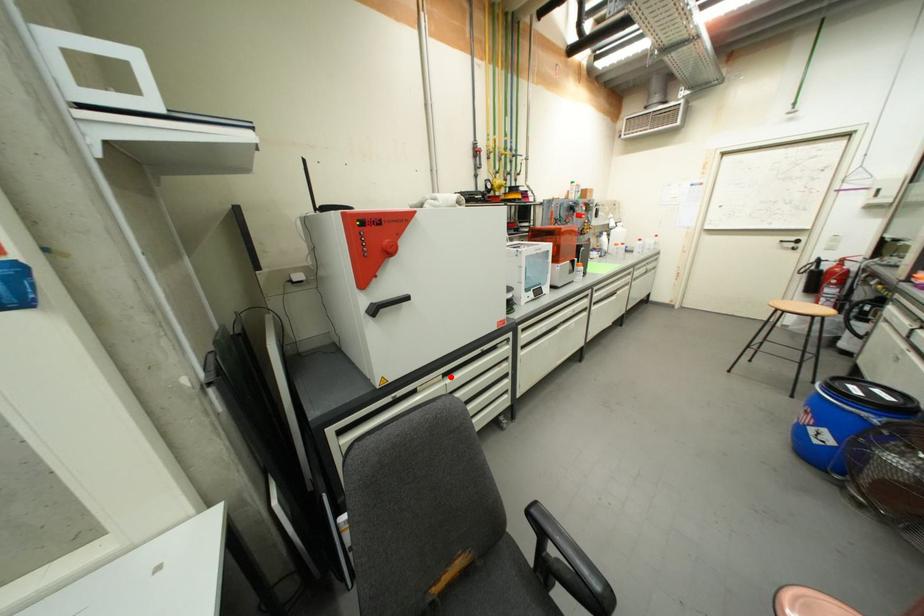
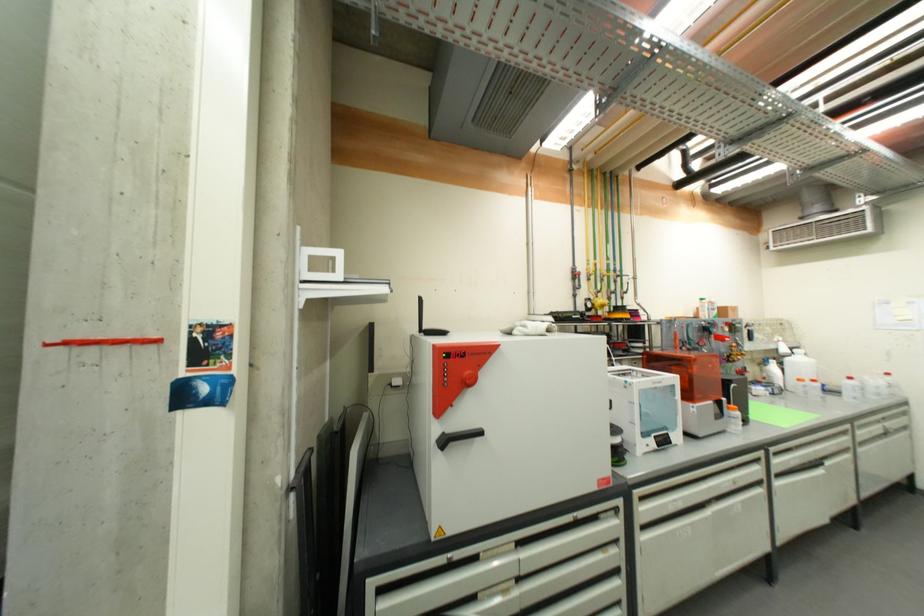
Find the pixel in the second image that matches the highlighted location in the first image.

(525, 546)